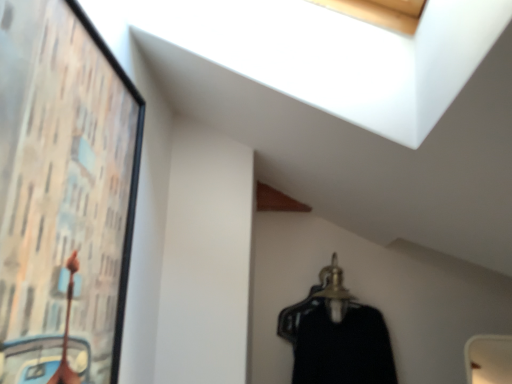
Question: From the image's perspective, is wooden framed artwork at left under gold metallic hanger at lower center?

Choices:
 (A) yes
 (B) no

Answer: (B)

Question: Does wooden framed artwork at left appear on the right side of gold metallic hanger at lower center?

Choices:
 (A) no
 (B) yes

Answer: (A)

Question: Considering the relative sizes of wooden framed artwork at left and gold metallic hanger at lower center in the image provided, is wooden framed artwork at left smaller than gold metallic hanger at lower center?

Choices:
 (A) yes
 (B) no

Answer: (B)

Question: Are wooden framed artwork at left and gold metallic hanger at lower center making contact?

Choices:
 (A) no
 (B) yes

Answer: (A)

Question: Is wooden framed artwork at left taller than gold metallic hanger at lower center?

Choices:
 (A) no
 (B) yes

Answer: (B)

Question: In terms of height, does wooden framed artwork at left look taller or shorter compared to black matte dress at center?

Choices:
 (A) short
 (B) tall

Answer: (B)

Question: Relative to black matte dress at center, is wooden framed artwork at left in front or behind?

Choices:
 (A) front
 (B) behind

Answer: (A)

Question: Considering the positions of wooden framed artwork at left and black matte dress at center in the image, is wooden framed artwork at left wider or thinner than black matte dress at center?

Choices:
 (A) thin
 (B) wide

Answer: (A)

Question: Considering the positions of point (82, 218) and point (370, 342), is point (82, 218) closer or farther from the camera than point (370, 342)?

Choices:
 (A) closer
 (B) farther

Answer: (A)

Question: Is gold metallic hanger at lower center bigger or smaller than wooden framed artwork at left?

Choices:
 (A) small
 (B) big

Answer: (A)

Question: Is gold metallic hanger at lower center in front of or behind wooden framed artwork at left in the image?

Choices:
 (A) front
 (B) behind

Answer: (B)

Question: From the image's perspective, is gold metallic hanger at lower center above or below wooden framed artwork at left?

Choices:
 (A) below
 (B) above

Answer: (A)

Question: From a real-world perspective, relative to wooden framed artwork at left, is gold metallic hanger at lower center vertically above or below?

Choices:
 (A) above
 (B) below

Answer: (B)

Question: Considering the positions of black matte dress at center and gold metallic hanger at lower center in the image, is black matte dress at center taller or shorter than gold metallic hanger at lower center?

Choices:
 (A) short
 (B) tall

Answer: (B)

Question: Is point (320, 355) closer or farther from the camera than point (352, 297)?

Choices:
 (A) closer
 (B) farther

Answer: (A)